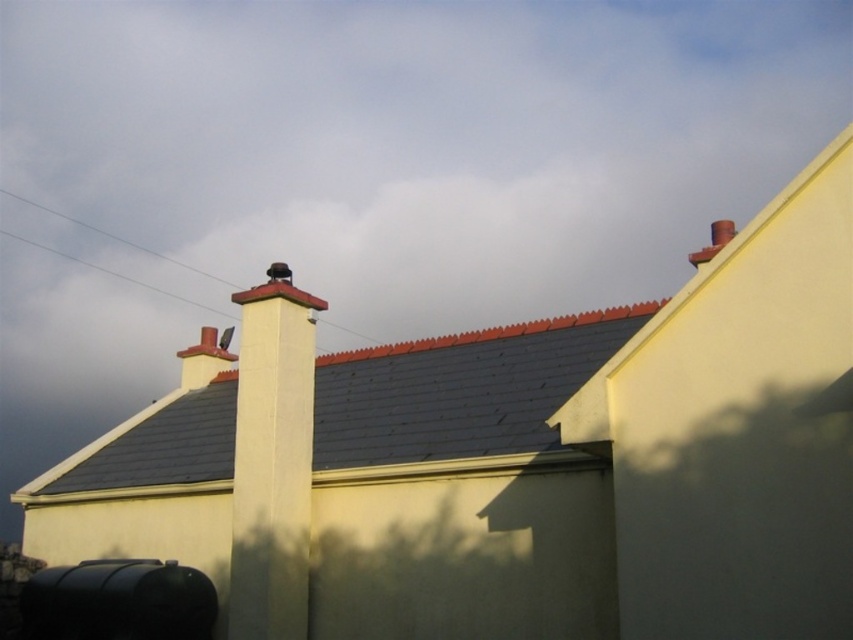
Does gray slate roof at center have a greater height compared to white smooth chimney at center?

No.

Does gray slate roof at center lie in front of white smooth chimney at center?

Yes.

Image resolution: width=853 pixels, height=640 pixels. Describe the element at coordinates (459, 390) in the screenshot. I see `gray slate roof at center` at that location.

Locate an element on the screen. This screenshot has height=640, width=853. gray slate roof at center is located at coordinates (459, 390).